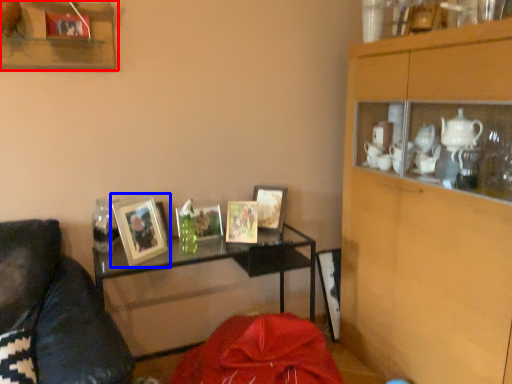
Question: Which object appears closest to the camera in this image, shelf (highlighted by a red box) or picture frame (highlighted by a blue box)?

Choices:
 (A) shelf
 (B) picture frame

Answer: (A)